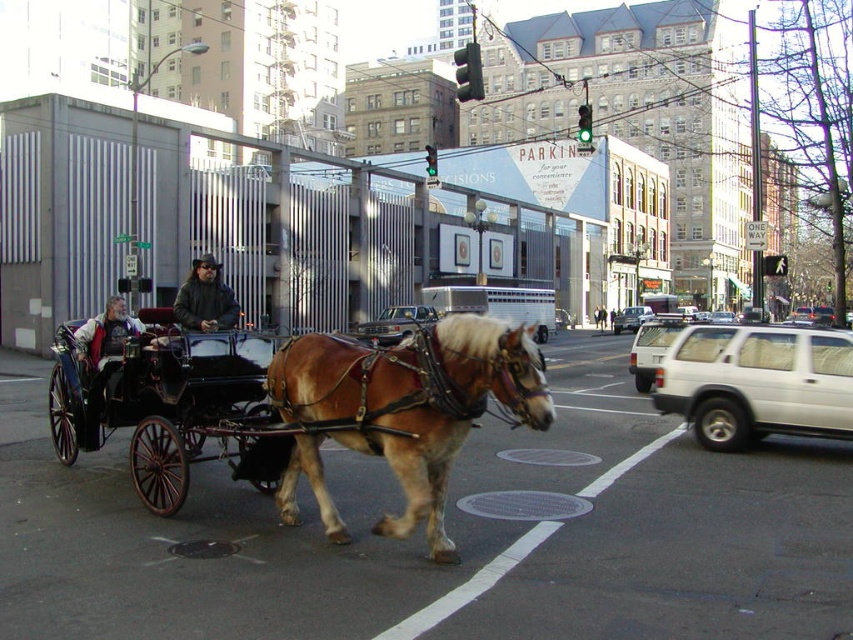
Between dark brown leather jacket at center and white matte suv at center-right, which one appears on the left side from the viewer's perspective?

From the viewer's perspective, dark brown leather jacket at center appears more on the left side.

Between point (204, 257) and point (670, 324), which one is positioned in front?

Point (204, 257) is in front.

In order to click on dark brown leather jacket at center in this screenshot , I will do `click(206, 298)`.

Is gray wool jacket at left positioned before white matte suv at center?

Yes.

Between gray wool jacket at left and white matte suv at center, which one appears on the right side from the viewer's perspective?

Positioned to the right is white matte suv at center.

In order to click on gray wool jacket at left in this screenshot , I will do `click(106, 332)`.

Where is `gray wool jacket at left`? The width and height of the screenshot is (853, 640). gray wool jacket at left is located at coordinates (106, 332).

Which is more to the right, brown glossy horse at center or white matte suv at center-right?

Positioned to the right is white matte suv at center-right.

Can you confirm if brown glossy horse at center is smaller than white matte suv at center-right?

Indeed, brown glossy horse at center has a smaller size compared to white matte suv at center-right.

Is point (473, 321) farther from viewer compared to point (653, 333)?

No, it is not.

Locate an element on the screen. The width and height of the screenshot is (853, 640). brown glossy horse at center is located at coordinates (402, 410).